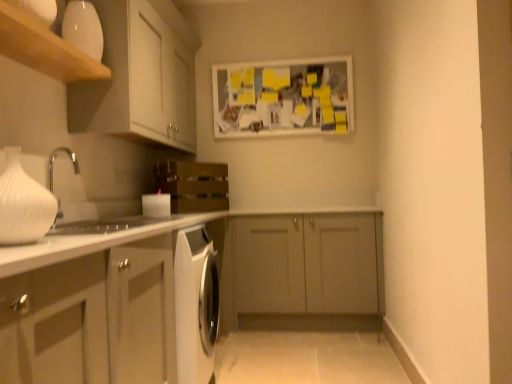
Image resolution: width=512 pixels, height=384 pixels. Find the location of `vacant space situated above white glossy sink at left (from a real-world perspective)`. vacant space situated above white glossy sink at left (from a real-world perspective) is located at coordinates (96, 200).